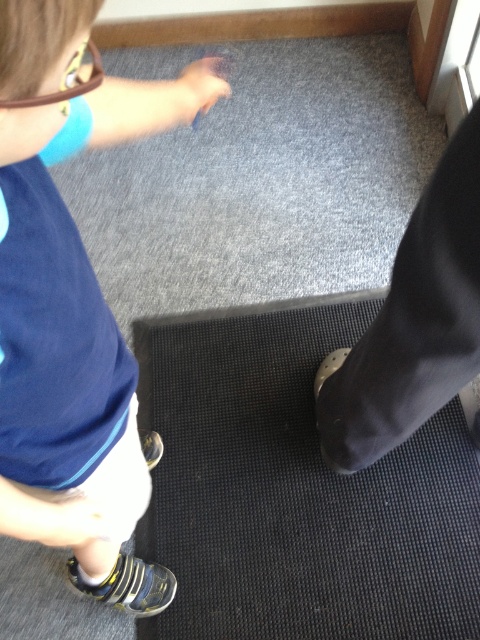
You are a delivery person who needs to place a small package on the black rubber mat at lower center. However, there is a blue fabric shirt at upper left in the way. Can you move the package to the mat without touching the shirt?

The black rubber mat at lower center is positioned on the right side of the blue fabric shirt at upper left, so you can move the package around the right side of the shirt to reach the mat without touching it.

You are designing a layout for a small home gym and need to place equipment. The black rubber mat at lower center and the blue fabric shirt at upper left are in the way. Which object is shorter and can be moved out of the way first?

The black rubber mat at lower center is not as tall as the blue fabric shirt at upper left, so it is shorter and can be moved out of the way first.

You are trying to determine if the black rubber mat at lower center can fit a yoga mat that is as wide as the blue fabric shirt at upper left. Based on the scene, will it fit?

The black rubber mat at lower center has a width larger than the blue fabric shirt at upper left, so the yoga mat will fit on the black rubber mat at lower center.